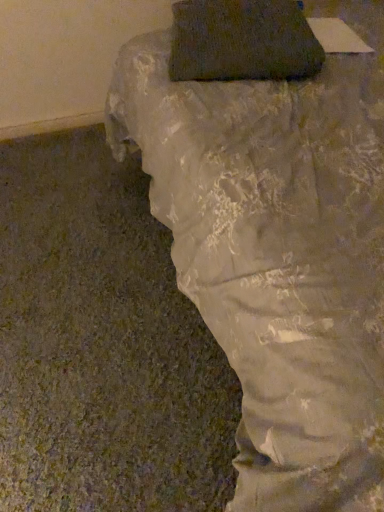
Locate an element on the screen. Image resolution: width=384 pixels, height=512 pixels. blank space situated above dark gray fabric pillow at upper center (from a real-world perspective) is located at coordinates (240, 14).